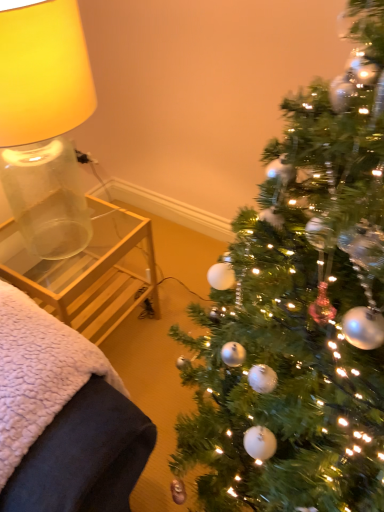
Question: Is the depth of clear glass side table at left less than that of clear glass table at left?

Choices:
 (A) no
 (B) yes

Answer: (B)

Question: Is clear glass side table at left to the right of clear glass table at left from the viewer's perspective?

Choices:
 (A) no
 (B) yes

Answer: (A)

Question: Is clear glass table at left inside clear glass side table at left?

Choices:
 (A) no
 (B) yes

Answer: (A)

Question: From the image's perspective, is clear glass side table at left below clear glass table at left?

Choices:
 (A) no
 (B) yes

Answer: (B)

Question: Considering the relative sizes of clear glass side table at left and clear glass table at left in the image provided, is clear glass side table at left thinner than clear glass table at left?

Choices:
 (A) yes
 (B) no

Answer: (B)

Question: Does clear glass side table at left have a larger size compared to clear glass table at left?

Choices:
 (A) no
 (B) yes

Answer: (A)

Question: Is green textured christmas tree at right shorter than translucent glass lampshade at left?

Choices:
 (A) no
 (B) yes

Answer: (A)

Question: Is there a large distance between green textured christmas tree at right and translucent glass lampshade at left?

Choices:
 (A) yes
 (B) no

Answer: (B)

Question: From the image's perspective, is green textured christmas tree at right located beneath translucent glass lampshade at left?

Choices:
 (A) no
 (B) yes

Answer: (B)

Question: Is green textured christmas tree at right at the left side of translucent glass lampshade at left?

Choices:
 (A) yes
 (B) no

Answer: (B)

Question: Is translucent glass lampshade at left completely or partially inside green textured christmas tree at right?

Choices:
 (A) no
 (B) yes

Answer: (A)

Question: From the image's perspective, would you say green textured christmas tree at right is positioned over translucent glass lampshade at left?

Choices:
 (A) no
 (B) yes

Answer: (A)

Question: From a real-world perspective, is translucent glass lampshade at left over clear glass side table at left?

Choices:
 (A) no
 (B) yes

Answer: (B)